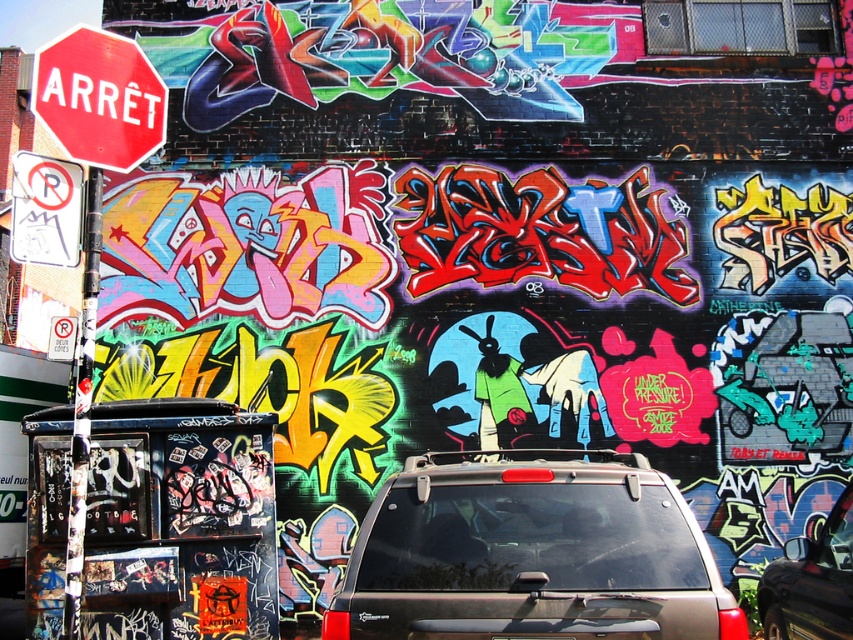
Does black matte car at lower right have a greater height compared to white paper no parking sign at left?

Indeed, black matte car at lower right has a greater height compared to white paper no parking sign at left.

What are the coordinates of `black matte car at lower right` in the screenshot? It's located at (811, 580).

Who is positioned more to the left, metallic silver minivan at center or black matte car at lower right?

metallic silver minivan at center

Which is more to the right, metallic silver minivan at center or black matte car at lower right?

Positioned to the right is black matte car at lower right.

This screenshot has width=853, height=640. Describe the element at coordinates (531, 554) in the screenshot. I see `metallic silver minivan at center` at that location.

At what (x,y) coordinates should I click in order to perform the action: click on metallic silver minivan at center. Please return your answer as a coordinate pair (x, y). Looking at the image, I should click on (531, 554).

Can you confirm if metallic silver minivan at center is taller than matte red stop sign at upper left?

Yes.

Is point (595, 621) less distant than point (86, 35)?

Yes, point (595, 621) is closer to viewer.

The height and width of the screenshot is (640, 853). What are the coordinates of `metallic silver minivan at center` in the screenshot? It's located at (531, 554).